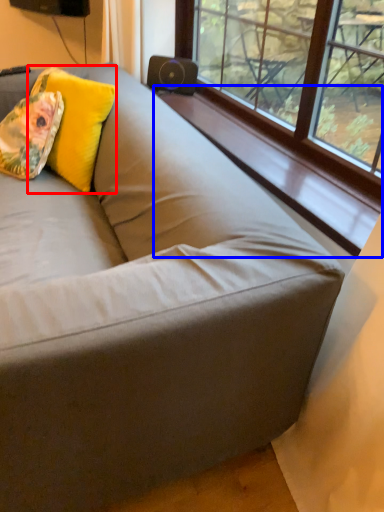
Question: Among these objects, which one is farthest to the camera, throw pillow (highlighted by a red box) or window sill (highlighted by a blue box)?

Choices:
 (A) throw pillow
 (B) window sill

Answer: (A)